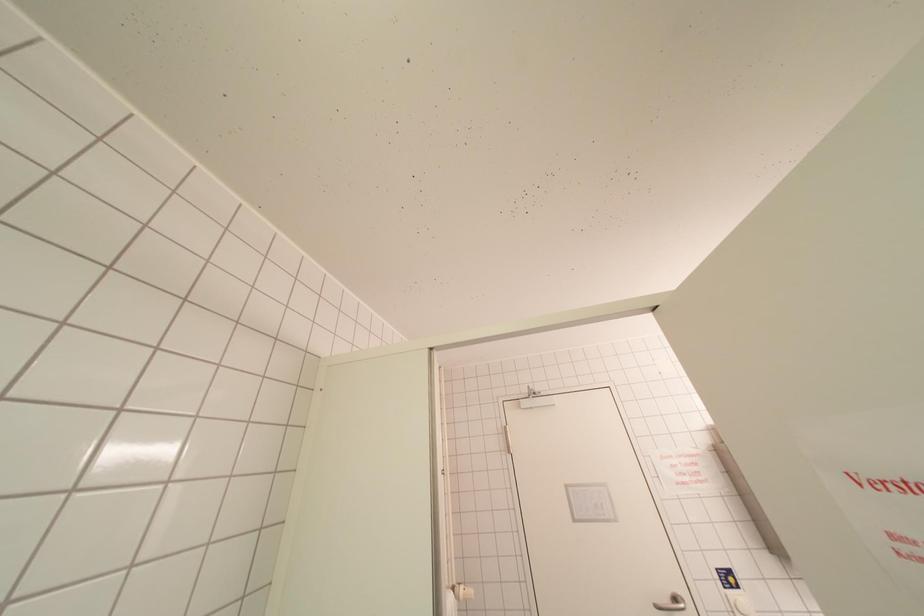
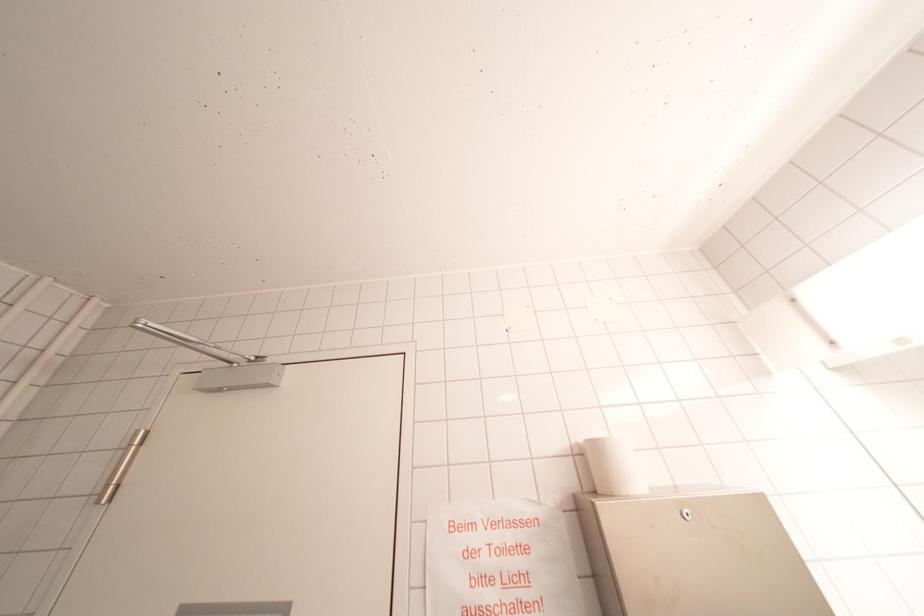
What movement of the cameraman would produce the second image?

The movement direction of the cameraman is right, forward.